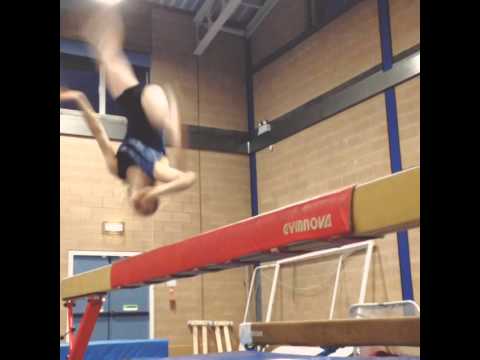
This screenshot has height=360, width=480. What are the coordinates of `window pane` in the screenshot? It's located at (71, 65), (111, 108).